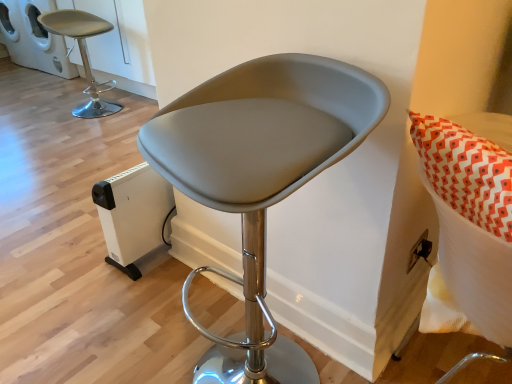
Question: From the image's perspective, relative to matte gray stool at center, the second chair when ordered from top to bottom, is white plastic cat house at upper left, arranged as the 1th appliance when viewed from the top, above or below?

Choices:
 (A) below
 (B) above

Answer: (B)

Question: Is white plastic cat house at upper left, arranged as the 1th appliance when viewed from the top, bigger or smaller than matte gray stool at center, which appears as the 2th chair when viewed from the back?

Choices:
 (A) big
 (B) small

Answer: (A)

Question: Estimate the real-world distances between objects in this image. Which object is farther from the matte gray stool at center, acting as the 1th chair starting from the bottom?

Choices:
 (A) matte gray stool at upper left, acting as the 2th chair starting from the front
 (B) white plastic cat house at upper left, the second appliance from the right
 (C) white plastic heater at lower left, which is the 2th appliance from left to right

Answer: (B)

Question: Which is nearer to the matte gray stool at center, marked as the 1th chair in a right-to-left arrangement?

Choices:
 (A) white plastic cat house at upper left, the 1th appliance viewed from the left
 (B) matte gray stool at upper left, acting as the 2th chair starting from the front
 (C) white plastic heater at lower left, placed as the second appliance when sorted from top to bottom

Answer: (C)